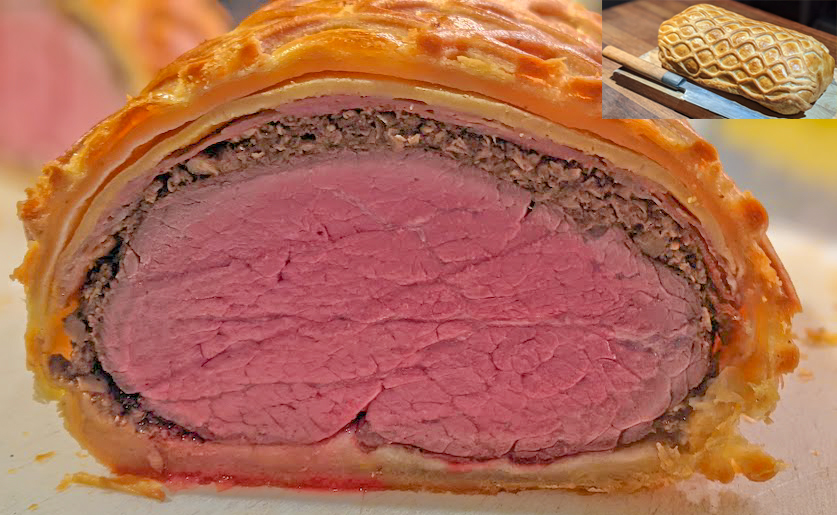
At what (x,y) coordinates should I click in order to perform the action: click on utensil handle. Please return your answer as a coordinate pair (x, y). Image resolution: width=837 pixels, height=515 pixels. Looking at the image, I should click on (618, 52).